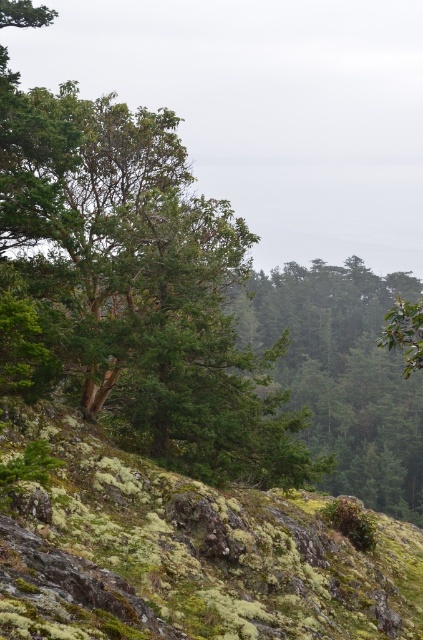
You are standing at the origin point of the coordinate system in this forest scene. Where is the green mossy rock at center located in terms of its 2D coordinates?

The green mossy rock at center is located at the 2D coordinates of point (184,554).

You are a hiker navigating through the forest and want to step onto the green mossy rock at center. However, there is a green matte tree at center blocking your path. Can you step onto the rock without moving the tree?

The green mossy rock at center is closer to the viewer than the green matte tree at center, so you can step onto the green mossy rock at center without moving the tree because it is in front of the tree.